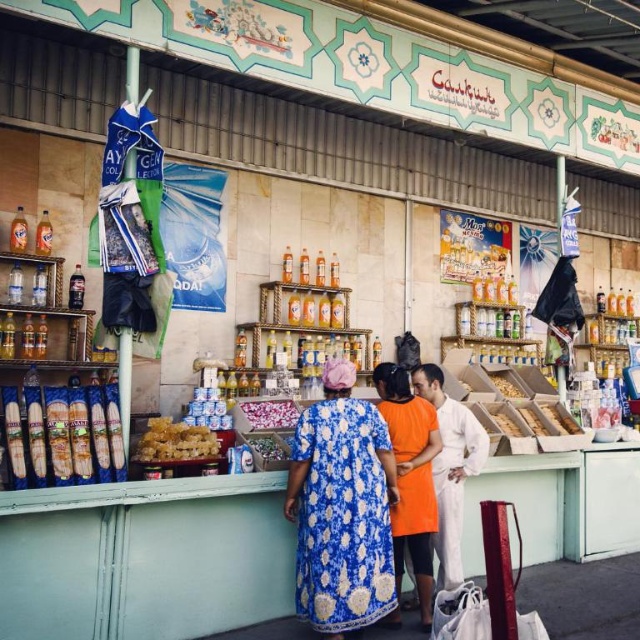
Question: Which of the following is the farthest from the observer?

Choices:
 (A) (502, 422)
 (B) (266, 433)
 (C) (209, 444)

Answer: (A)

Question: Which is nearer to the orange cotton dress at center?

Choices:
 (A) shiny plastic candy at center
 (B) smooth plastic snack at center
 (C) smooth plastic bread at center

Answer: (A)

Question: Where is white cotton shirt at center located in relation to translucent plastic bag at center in the image?

Choices:
 (A) right
 (B) left

Answer: (A)

Question: Is white cotton shirt at center positioned at the back of shiny plastic candy at center?

Choices:
 (A) yes
 (B) no

Answer: (A)

Question: Is pink fabric at center further to camera compared to golden brown bread at center?

Choices:
 (A) yes
 (B) no

Answer: (B)

Question: Which object is the farthest from the golden brown bread at center?

Choices:
 (A) shiny plastic candy at center
 (B) floral fabric dress at center
 (C) translucent plastic bag at center
 (D) smooth plastic bread at center

Answer: (C)